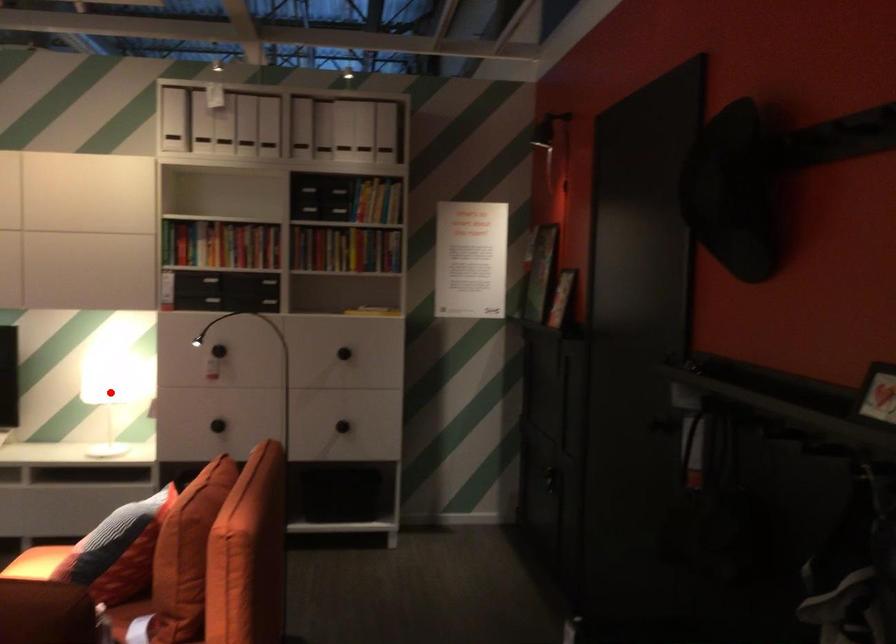
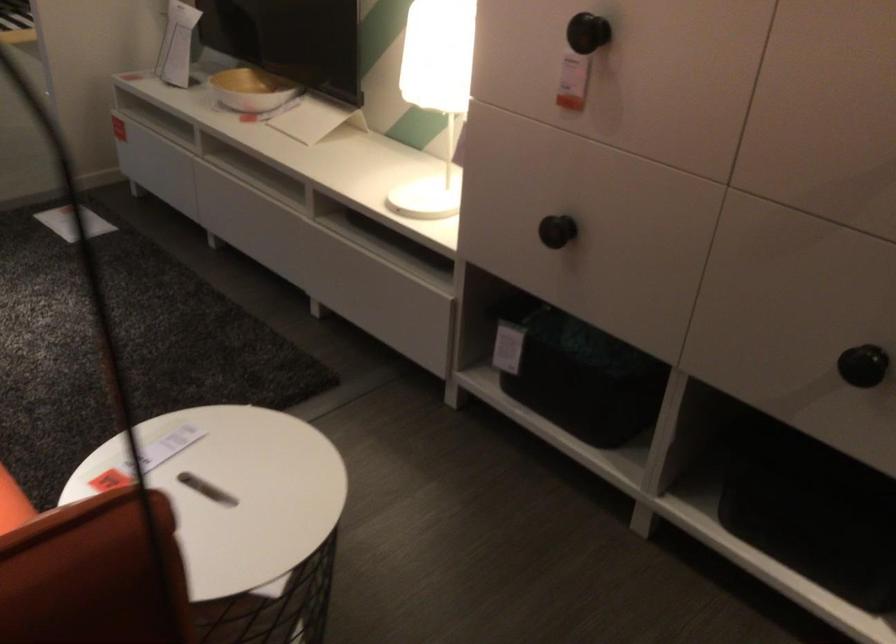
In the second image, find the point that corresponds to the highlighted location in the first image.

(435, 93)